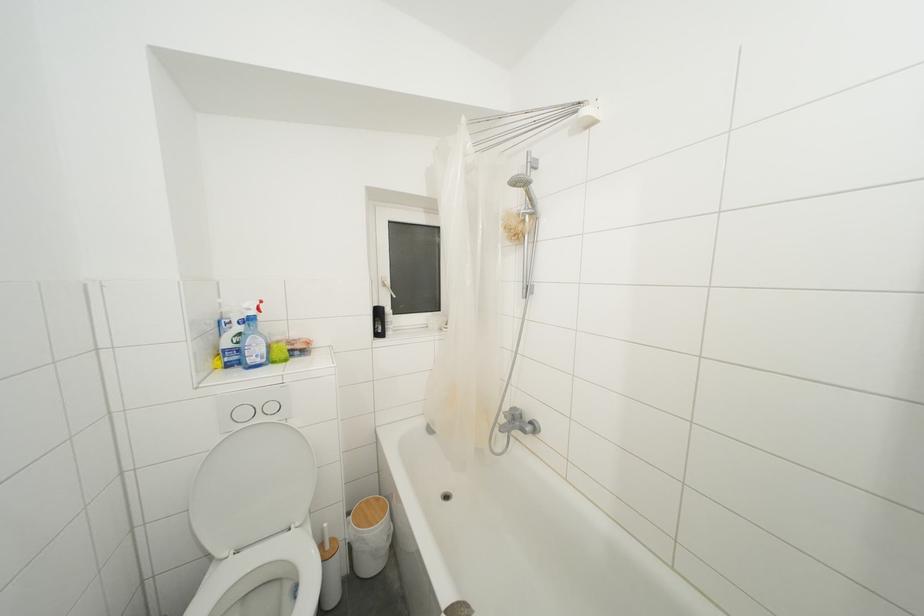
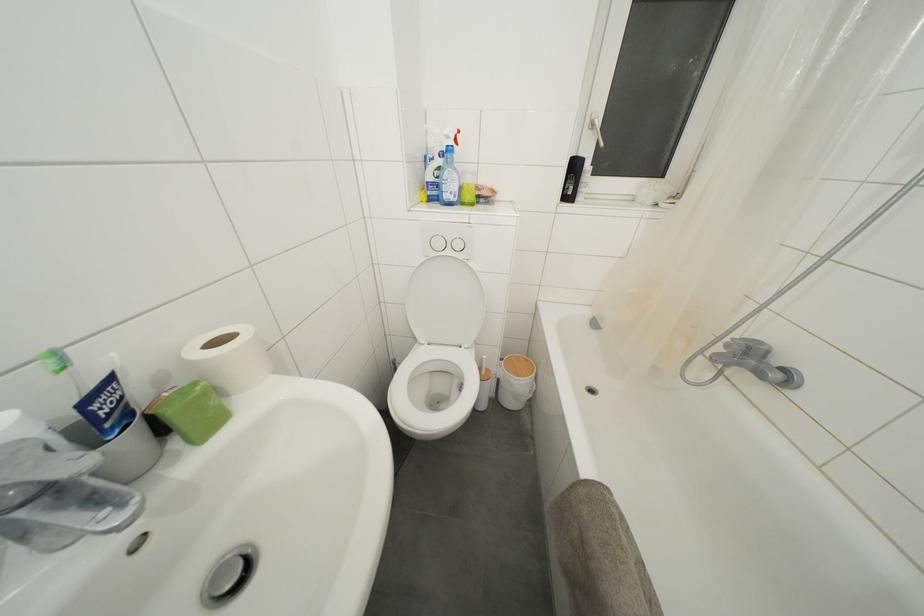
Where in the second image is the point corresponding to the point at 249,310 from the first image?

(450, 138)